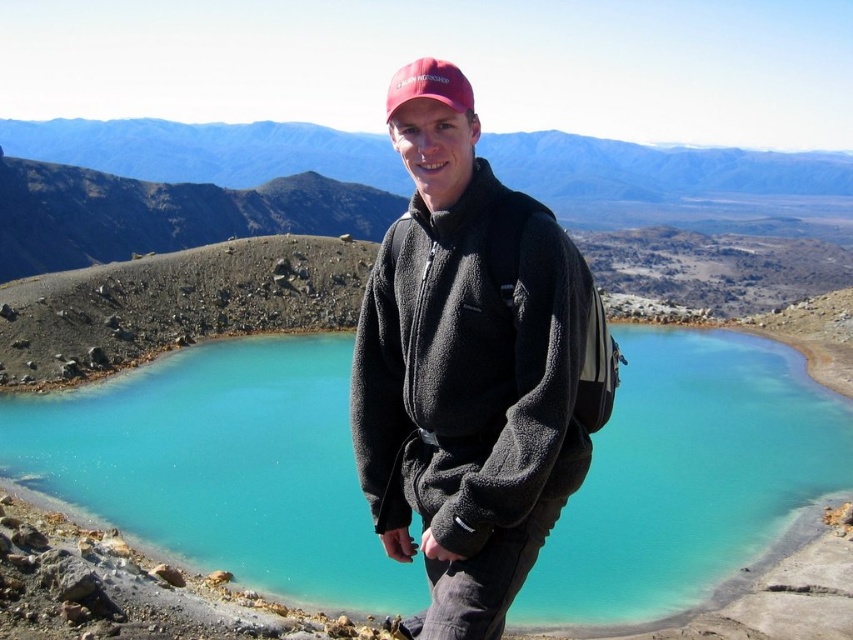
You are a photographer trying to capture the entire scene of the turquoise glossy water at center and the black fleece jacket at center in one frame. Based on their sizes, which object will appear more dominant in the photo?

The turquoise glossy water at center will appear more dominant in the photo because it is larger in size than the black fleece jacket at center.

You are a hiker planning to navigate from point A to point B in the mountainous area shown. The coordinates for point A are point (514,481) and point B are point (401,93). Based on the scene, which direction should you move to go from point A to point B?

To go from point A to point B, you should move towards the lower left direction since point A is in front of point B in the image. Moving towards the lower left will take you closer to point B.